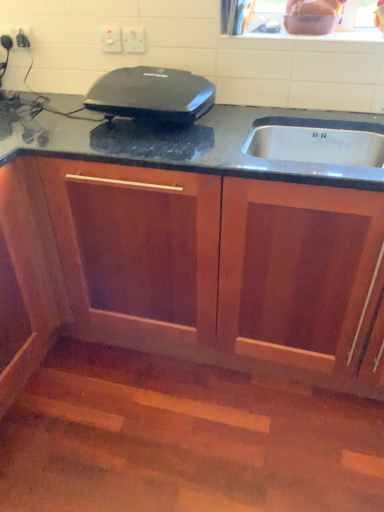
Question: Is wooden cabinet at center oriented away from black glossy waffle maker at center?

Choices:
 (A) no
 (B) yes

Answer: (A)

Question: Is wooden cabinet at center far from black glossy waffle maker at center?

Choices:
 (A) yes
 (B) no

Answer: (B)

Question: Is wooden cabinet at center smaller than black glossy waffle maker at center?

Choices:
 (A) no
 (B) yes

Answer: (A)

Question: Does wooden cabinet at center have a lesser height compared to black glossy waffle maker at center?

Choices:
 (A) no
 (B) yes

Answer: (A)

Question: Is the position of wooden cabinet at center less distant than that of black glossy waffle maker at center?

Choices:
 (A) yes
 (B) no

Answer: (A)

Question: Looking at the image, does white plastic electric outlet at upper center, which is the 2th electric outlet in right-to-left order, seem bigger or smaller compared to black glossy waffle maker at center?

Choices:
 (A) big
 (B) small

Answer: (B)

Question: Is white plastic electric outlet at upper center, the first electric outlet from the left, in front of or behind black glossy waffle maker at center in the image?

Choices:
 (A) front
 (B) behind

Answer: (B)

Question: Looking at their shapes, would you say white plastic electric outlet at upper center, which is the 2th electric outlet in right-to-left order, is wider or thinner than black glossy waffle maker at center?

Choices:
 (A) wide
 (B) thin

Answer: (B)

Question: Is white plastic electric outlet at upper center, the first electric outlet from the left, inside or outside of black glossy waffle maker at center?

Choices:
 (A) outside
 (B) inside

Answer: (A)

Question: In the image, is metallic silver toaster at upper left positioned in front of or behind wooden cabinet at center?

Choices:
 (A) behind
 (B) front

Answer: (A)

Question: In terms of size, does metallic silver toaster at upper left appear bigger or smaller than wooden cabinet at center?

Choices:
 (A) small
 (B) big

Answer: (A)

Question: Is metallic silver toaster at upper left taller or shorter than wooden cabinet at center?

Choices:
 (A) tall
 (B) short

Answer: (B)

Question: Looking at their shapes, would you say metallic silver toaster at upper left is wider or thinner than wooden cabinet at center?

Choices:
 (A) wide
 (B) thin

Answer: (B)

Question: From the image's perspective, is wooden cabinet at center positioned above or below white plastic electric outlet at upper center, placed as the first electric outlet when sorted from right to left?

Choices:
 (A) above
 (B) below

Answer: (B)

Question: Based on their positions, is wooden cabinet at center located to the left or right of white plastic electric outlet at upper center, placed as the first electric outlet when sorted from right to left?

Choices:
 (A) left
 (B) right

Answer: (B)